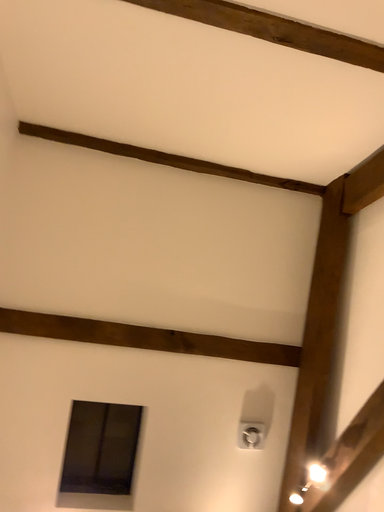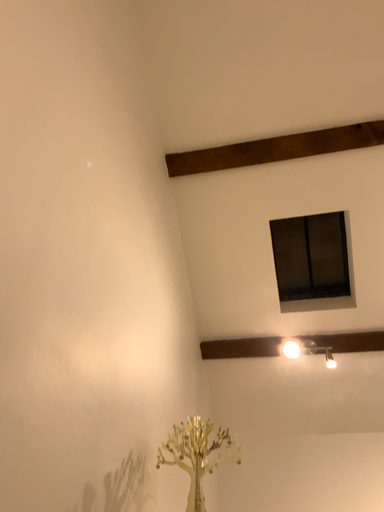
Question: Which way did the camera rotate in the video?

Choices:
 (A) rotated downward
 (B) rotated upward

Answer: (A)